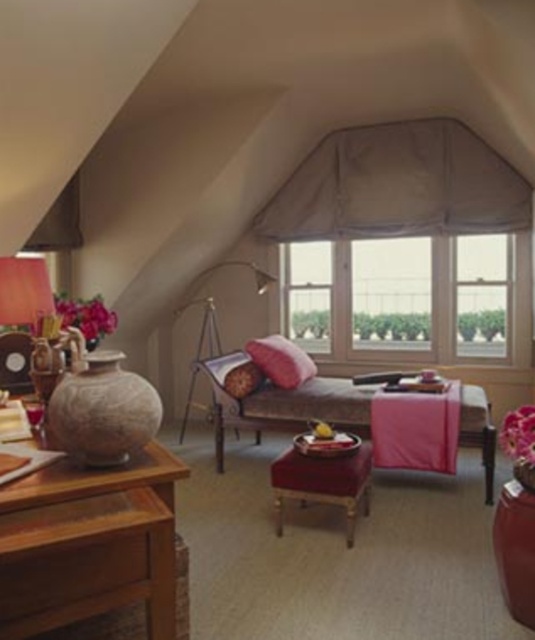
You are standing in the attic room and want to place a new decorative item between the metallic gold floor lamp at center and the matte pink pillow at center. Which object should you move closer to you to create space?

You should move the metallic gold floor lamp at center closer to you because it is already closer than the matte pink pillow at center, so moving it further forward would create space between them.

You are planning to place a new rectangular rug in the center of the room. The rug must fit entirely between the pink fabric couch at center and the metallic gold floor lamp at center. Given that the rug is 1.2 meters wide, will it fit if placed between them?

The pink fabric couch at center is wider than the metallic gold floor lamp at center. Since the rug is 1.2 meters wide, it must fit within the narrower space between them. However, without knowing the exact distance between the two objects, we cannot confirm if the rug will fit. Please measure the space between the pink fabric couch at center and the metallic gold floor lamp at center first.

You are planning to place a new decorative item in the center of the room. You have a small round table that is 30 cm in diameter. Considering the existing metallic gold floor lamp at center and matte pink pillow at center, will the table fit between them without overlapping?

The metallic gold floor lamp at center might be wider than the matte pink pillow at center, so the table may not fit between them if the lamp is wider. Check the actual width of the lamp before placing the table.